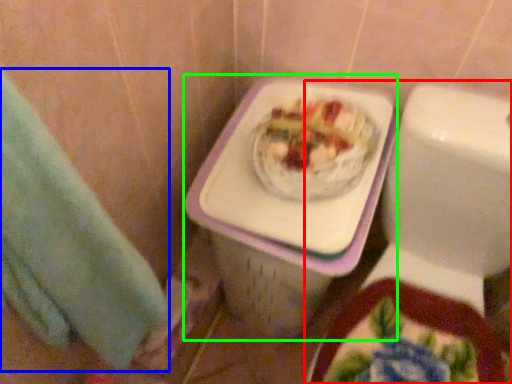
Question: Which object is the closest to the toilet (highlighted by a red box)? Choose among these: hand towel (highlighted by a blue box) or porcelain (highlighted by a green box).

Choices:
 (A) hand towel
 (B) porcelain

Answer: (B)